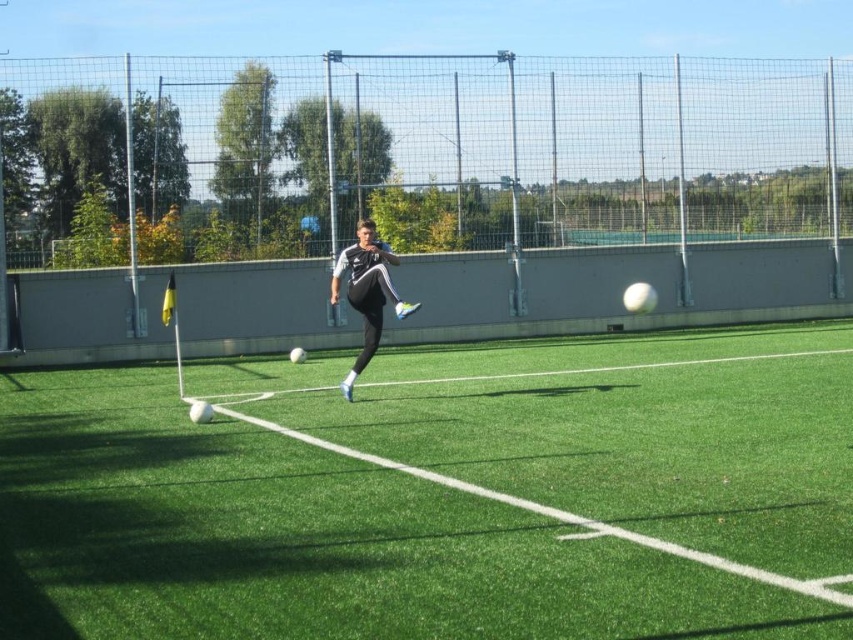
What is the exact coordinate of the green artificial turf at center?

The green artificial turf at center is located at point (437, 492).

You are a soccer coach observing a training session. You notice the green artificial turf at center and the black matte soccer player at center. Which object is closer to you, the observer?

The green artificial turf at center is closer to you because it is in front of the black matte soccer player at center.